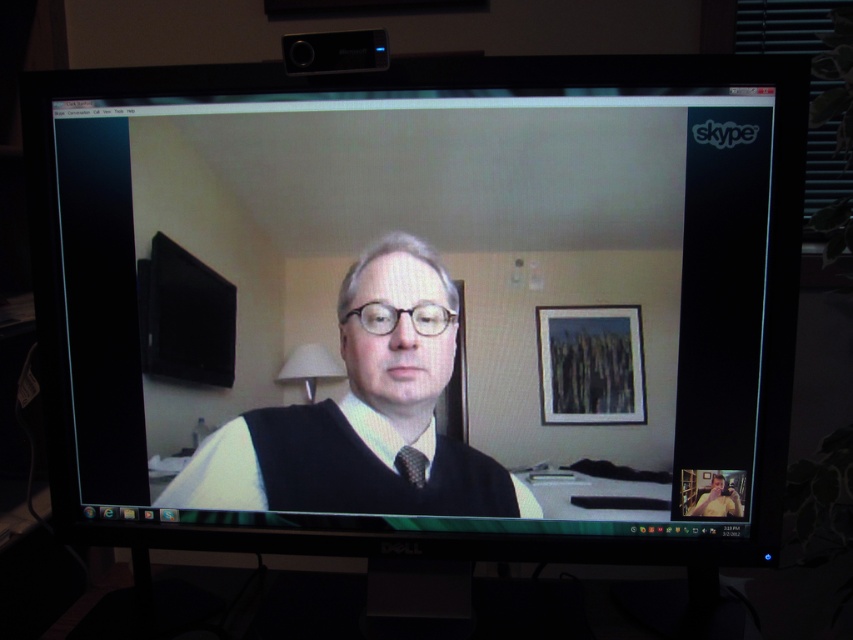
Is matte black sweater at center thinner than black textured tie at center?

In fact, matte black sweater at center might be wider than black textured tie at center.

Where is `matte black sweater at center`? Image resolution: width=853 pixels, height=640 pixels. matte black sweater at center is located at coordinates (363, 413).